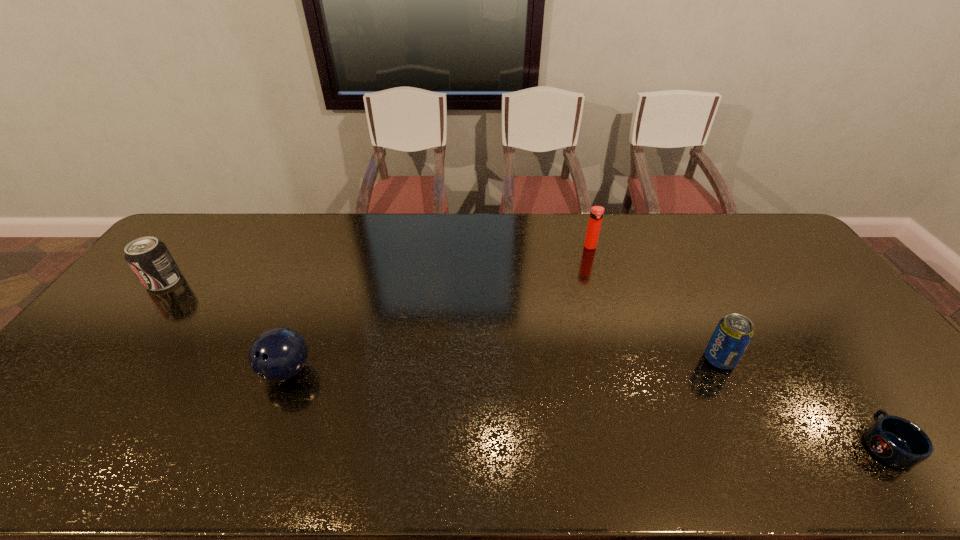
Where is `empty location between the bowling ball and the nearer soda`? This screenshot has height=540, width=960. empty location between the bowling ball and the nearer soda is located at coordinates (503, 365).

The height and width of the screenshot is (540, 960). I want to click on free space that is in between the farther soda and the right soda, so click(x=442, y=320).

This screenshot has height=540, width=960. In order to click on vacant area between the bowling ball and the thermos bottle in this screenshot , I will do `click(439, 309)`.

Locate an element on the screen. blank region between the left soda and the nearer soda is located at coordinates (442, 320).

Identify the location of unoccupied position between the farthest object and the fourth object from right to left. (439, 309).

Locate an element on the screen. Image resolution: width=960 pixels, height=540 pixels. free space that is in between the third object from right to left and the fourth nearest object is located at coordinates (377, 264).

Locate an element on the screen. object that can be found as the fourth closest to the farther soda is located at coordinates (898, 442).

Find the location of a particular element. object that is the closest one to the third object from right to left is located at coordinates (734, 332).